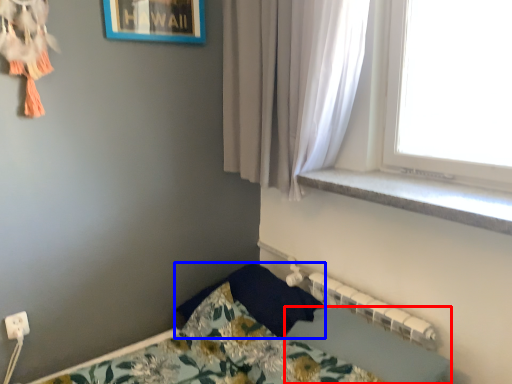
Question: Which point is further to the camera, sheet (highlighted by a red box) or pillow (highlighted by a blue box)?

Choices:
 (A) sheet
 (B) pillow

Answer: (B)